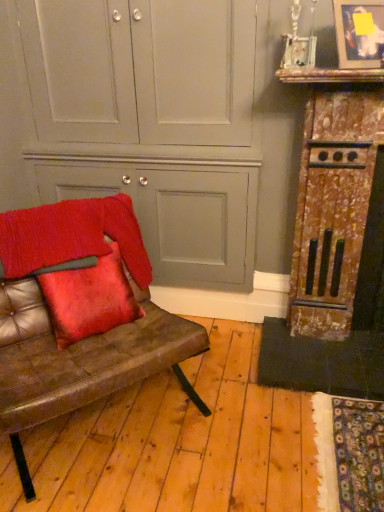
Question: Does leather couch at left appear on the right side of metallic silver picture frame at upper right?

Choices:
 (A) no
 (B) yes

Answer: (A)

Question: Is leather couch at left positioned beyond the bounds of metallic silver picture frame at upper right?

Choices:
 (A) no
 (B) yes

Answer: (B)

Question: Considering the relative sizes of leather couch at left and metallic silver picture frame at upper right in the image provided, is leather couch at left taller than metallic silver picture frame at upper right?

Choices:
 (A) yes
 (B) no

Answer: (A)

Question: From the image's perspective, is leather couch at left beneath metallic silver picture frame at upper right?

Choices:
 (A) no
 (B) yes

Answer: (B)

Question: Does leather couch at left have a lesser height compared to metallic silver picture frame at upper right?

Choices:
 (A) yes
 (B) no

Answer: (B)

Question: From the image's perspective, relative to rusty metal fireplace at right, which ranks as the second dresser in left-to-right order, is metallic silver picture frame at upper right above or below?

Choices:
 (A) above
 (B) below

Answer: (A)

Question: Considering the positions of metallic silver picture frame at upper right and rusty metal fireplace at right, which ranks as the second dresser in left-to-right order, in the image, is metallic silver picture frame at upper right taller or shorter than rusty metal fireplace at right, which ranks as the second dresser in left-to-right order,?

Choices:
 (A) short
 (B) tall

Answer: (A)

Question: Considering the positions of metallic silver picture frame at upper right and rusty metal fireplace at right, marked as the first dresser in a right-to-left arrangement, in the image, is metallic silver picture frame at upper right bigger or smaller than rusty metal fireplace at right, marked as the first dresser in a right-to-left arrangement,?

Choices:
 (A) small
 (B) big

Answer: (A)

Question: Is metallic silver picture frame at upper right to the left or to the right of rusty metal fireplace at right, marked as the first dresser in a right-to-left arrangement, in the image?

Choices:
 (A) left
 (B) right

Answer: (A)

Question: From their relative heights in the image, would you say metallic silver picture frame at upper right is taller or shorter than matte gray cabinet at center, placed as the first dresser when sorted from left to right?

Choices:
 (A) short
 (B) tall

Answer: (A)

Question: From a real-world perspective, is metallic silver picture frame at upper right physically located above or below matte gray cabinet at center, placed as the first dresser when sorted from left to right?

Choices:
 (A) below
 (B) above

Answer: (B)

Question: Is metallic silver picture frame at upper right wider or thinner than matte gray cabinet at center, placed as the first dresser when sorted from left to right?

Choices:
 (A) wide
 (B) thin

Answer: (B)

Question: Relative to matte gray cabinet at center, which appears as the second dresser when viewed from the right, is metallic silver picture frame at upper right in front or behind?

Choices:
 (A) front
 (B) behind

Answer: (A)

Question: Is point (301, 249) positioned closer to the camera than point (72, 264)?

Choices:
 (A) farther
 (B) closer

Answer: (A)

Question: From their relative heights in the image, would you say rusty metal fireplace at right, marked as the first dresser in a right-to-left arrangement, is taller or shorter than leather couch at left?

Choices:
 (A) tall
 (B) short

Answer: (A)